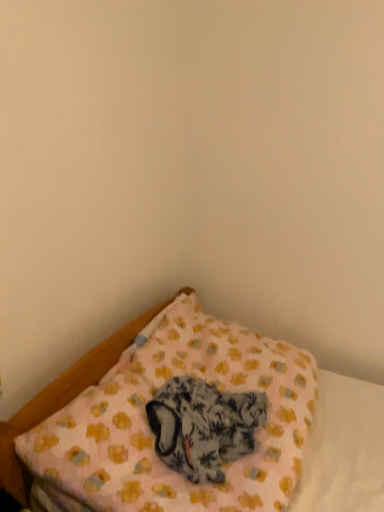
Question: Could you tell me if pink fabric pillow at lower center is facing fluffy fabric cat at lower center?

Choices:
 (A) no
 (B) yes

Answer: (B)

Question: Is pink fabric pillow at lower center at the right side of fluffy fabric cat at lower center?

Choices:
 (A) no
 (B) yes

Answer: (B)

Question: Is pink fabric pillow at lower center further to camera compared to fluffy fabric cat at lower center?

Choices:
 (A) no
 (B) yes

Answer: (A)

Question: From the image's perspective, is pink fabric pillow at lower center located above fluffy fabric cat at lower center?

Choices:
 (A) no
 (B) yes

Answer: (B)

Question: From a real-world perspective, is pink fabric pillow at lower center located higher than fluffy fabric cat at lower center?

Choices:
 (A) no
 (B) yes

Answer: (A)

Question: From the image's perspective, is pink fabric pillow at lower center located beneath fluffy fabric cat at lower center?

Choices:
 (A) yes
 (B) no

Answer: (B)

Question: Considering the relative positions of fluffy fabric cat at lower center and pink fabric pillow at lower center in the image provided, is fluffy fabric cat at lower center to the right of pink fabric pillow at lower center from the viewer's perspective?

Choices:
 (A) yes
 (B) no

Answer: (B)

Question: From a real-world perspective, is fluffy fabric cat at lower center on pink fabric pillow at lower center?

Choices:
 (A) no
 (B) yes

Answer: (B)

Question: Are fluffy fabric cat at lower center and pink fabric pillow at lower center making contact?

Choices:
 (A) no
 (B) yes

Answer: (A)

Question: Is fluffy fabric cat at lower center closer to camera compared to pink fabric pillow at lower center?

Choices:
 (A) no
 (B) yes

Answer: (A)

Question: Can you confirm if fluffy fabric cat at lower center is bigger than pink fabric pillow at lower center?

Choices:
 (A) yes
 (B) no

Answer: (B)

Question: Does fluffy fabric cat at lower center appear on the left side of pink fabric pillow at lower center?

Choices:
 (A) no
 (B) yes

Answer: (B)

Question: In the image, is fluffy fabric cat at lower center positioned in front of or behind pink fabric pillow at lower center?

Choices:
 (A) behind
 (B) front

Answer: (A)